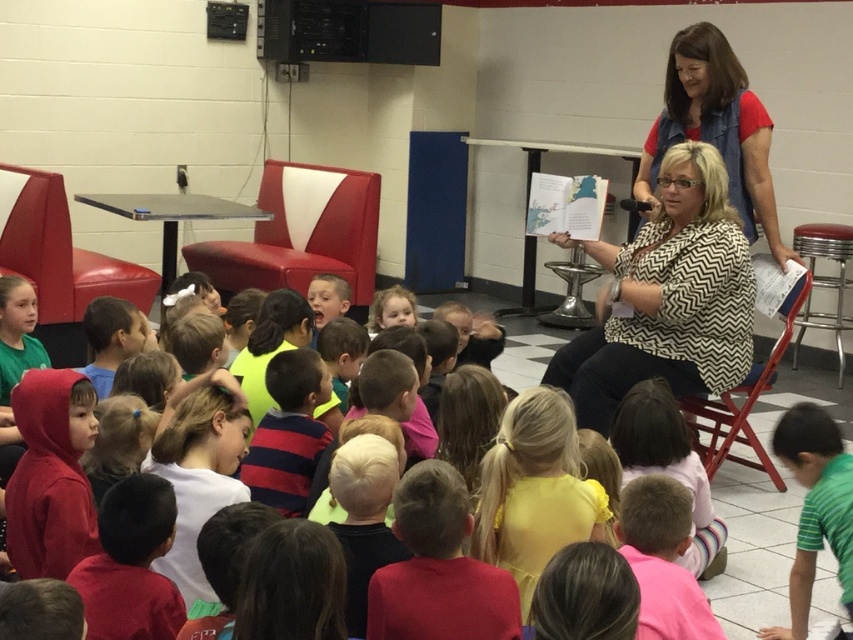
You are standing in the room and see two points marked in the image. Which point, point (714, 164) or point (698, 404), is closer to you?

Point (714, 164) is closer to the camera than point (698, 404), so it is closer to you.

You are a photographer standing in the center of the room. You want to take a photo of the green striped shirt at lower right and the metallic silver stool at right. Which object is closer to you?

The green striped shirt at lower right is closer to you because it is positioned under the metallic silver stool at right, meaning it is in front of the stool and thus nearer to your position.

You are a photographer standing in the center of the room. You want to take a photo of the green striped shirt at lower right and the metallic silver stool at right. Which object will appear wider in the photo?

The metallic silver stool at right will appear wider in the photo because it has a greater width compared to the green striped shirt at lower right.